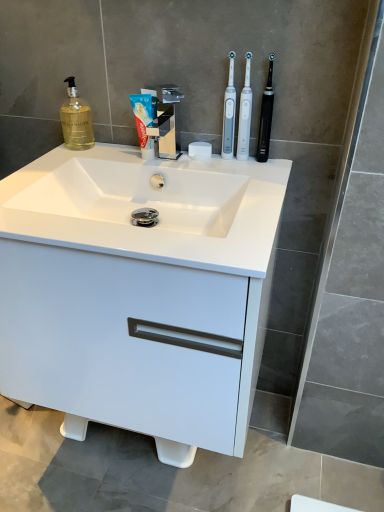
This screenshot has height=512, width=384. I want to click on free space to the left of white matte soap at center, so click(139, 158).